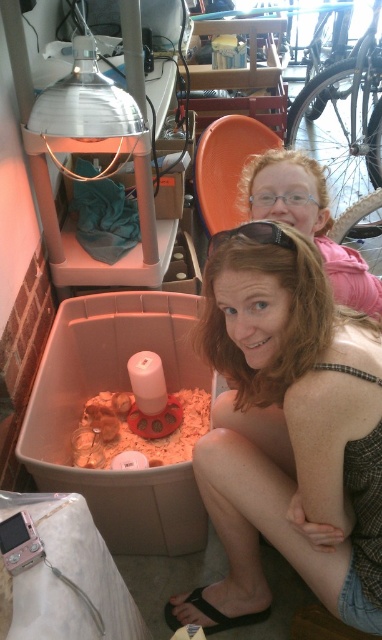
You are a photographer taking a picture of the matte pink shirt at upper right and the black plastic goggles at center. Which object should you focus on first to ensure both are in frame?

The matte pink shirt at upper right is positioned over the black plastic goggles at center, so you should focus on the matte pink shirt at upper right first to ensure both are in frame.